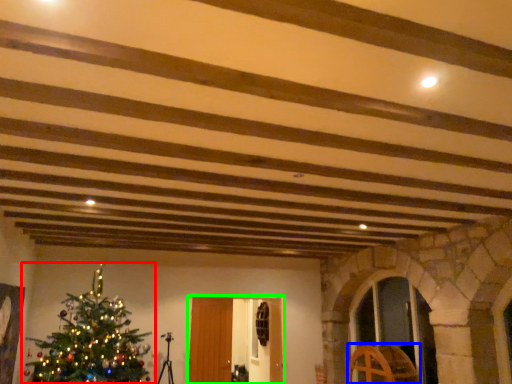
Question: Considering the real-world distances, which object is farthest from christmas tree (highlighted by a red box)? furniture (highlighted by a blue box) or glass door (highlighted by a green box)?

Choices:
 (A) furniture
 (B) glass door

Answer: (A)